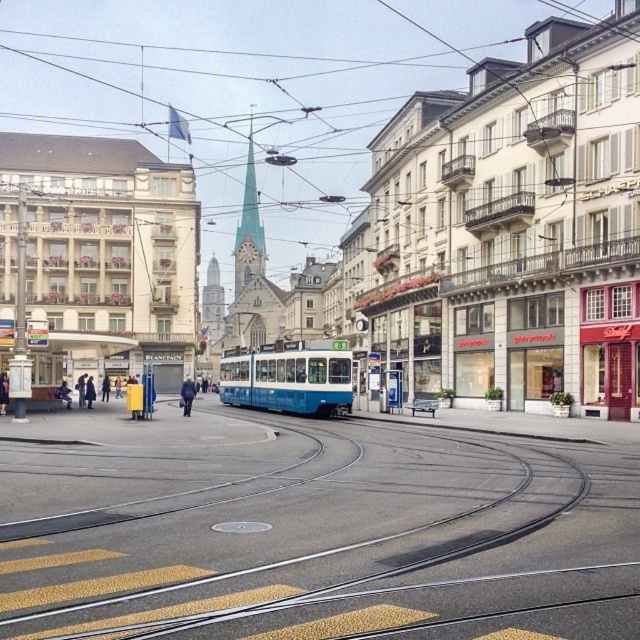
You are a city planner analyzing the street layout. Given the metallic track at center and the smooth white spire at center, which one occupies more space in the image?

The smooth white spire at center occupies more space in the image than the metallic track at center, as it is described as larger.

You are standing at point (234, 284) and want to walk to point (330, 536). Which direction should you face to walk towards your destination?

You should face forward because point (330, 536) is in front of point (234, 284).

You are a city planner analyzing the layout of this street. The tram must stay within the tram track. Given the coordinates of the metallic track at center, what is the exact coordinate point where the tram should be positioned to stay on the track?

The metallic track at center is positioned at point (310, 529), so the tram should be positioned at that coordinate to stay on the track.